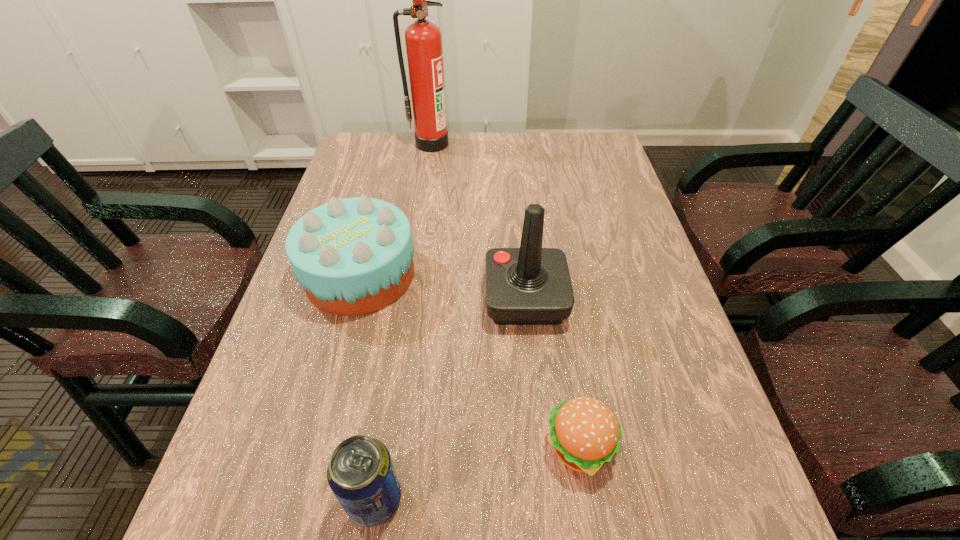
At what (x,y) coordinates should I click in order to perform the action: click on the tallest object. Please return your answer as a coordinate pair (x, y). The width and height of the screenshot is (960, 540). Looking at the image, I should click on (423, 39).

Locate an element on the screen. The height and width of the screenshot is (540, 960). fire extinguisher is located at coordinates (423, 39).

Where is `the fourth shortest object`? the fourth shortest object is located at coordinates (530, 285).

Locate an element on the screen. cake is located at coordinates (353, 256).

Find the location of a particular element. This screenshot has height=540, width=960. soda is located at coordinates (361, 474).

What are the coordinates of `hamburger` in the screenshot? It's located at (585, 434).

This screenshot has height=540, width=960. I want to click on free location located with the nozzle pointing from the back of the farthest object, so click(x=422, y=202).

The image size is (960, 540). Find the location of `vacant space located 0.190m on the front of the second tallest object`. vacant space located 0.190m on the front of the second tallest object is located at coordinates (537, 414).

I want to click on free region located 0.270m on the front of the cake, so click(317, 438).

You are a GUI agent. You are given a task and a screenshot of the screen. Output one action in this format:
    pyautogui.click(x=<x>, y=<y>)
    Task: Click on the vacant space situated 0.200m on the left of the soda
    The height and width of the screenshot is (540, 960).
    Given the screenshot: What is the action you would take?
    pyautogui.click(x=223, y=499)